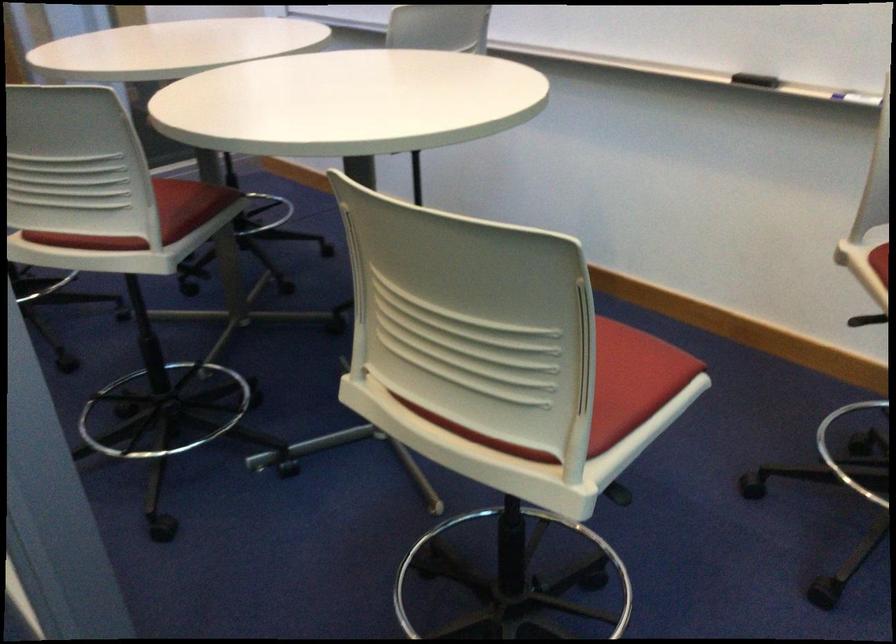
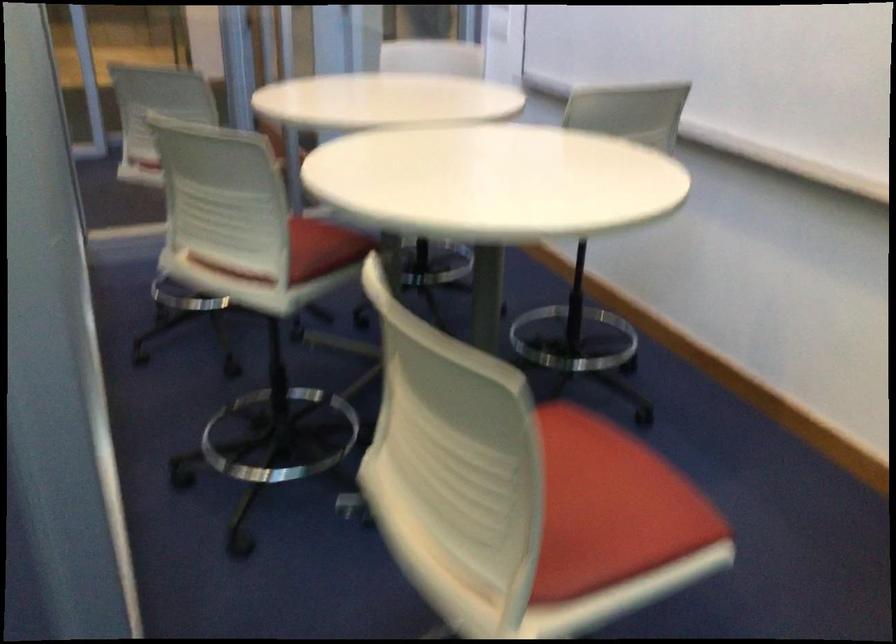
Find the pixel in the second image that matches pixel 183 204 in the first image.

(322, 249)